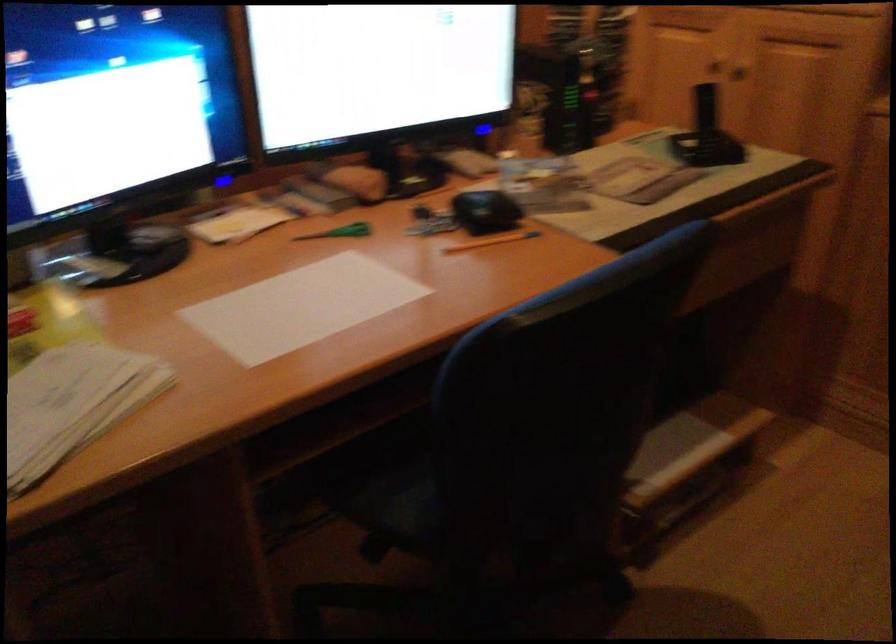
I want to click on orange pencil, so click(x=493, y=240).